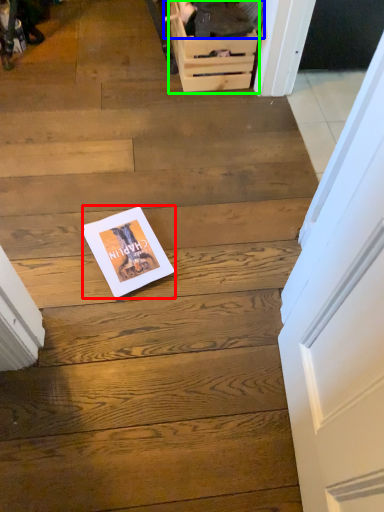
Question: Which object is positioned closest to magazine (highlighted by a red box)? Select from couple (highlighted by a blue box) and drawer (highlighted by a green box).

Choices:
 (A) couple
 (B) drawer

Answer: (B)